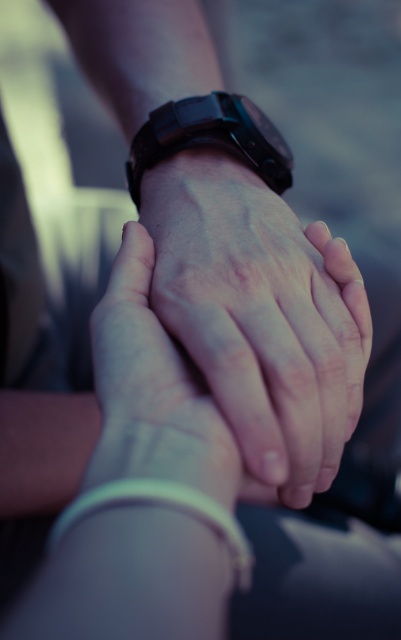
You are a photographer adjusting the focus of your camera. You want to ensure both the matte black watch at center and the white matte bracelet at lower center are clearly visible. Which object should you focus on first if you want to prioritize the one closer to the camera?

The matte black watch at center is positioned on the right side of white matte bracelet at lower center, so the white matte bracelet at lower center is closer to the camera. Focus on the white matte bracelet at lower center first.

You are a jeweler examining two watches in the image. The scene shows a close up of two hands clasped together, and you notice a matte black watch at center and a black matte watch at center. Which watch is taller?

The matte black watch at center is taller than the black matte watch at center.

You are a jeweler who needs to place a new ring between the matte black watch at center and the white matte bracelet at lower center. The ring requires a space of 7 inches. Based on the scene, will there be enough space between them for the ring?

The distance between the matte black watch at center and the white matte bracelet at lower center is 6.97 inches, which is slightly less than the required 7 inches. Therefore, there isn not enough space to place the ring between them.